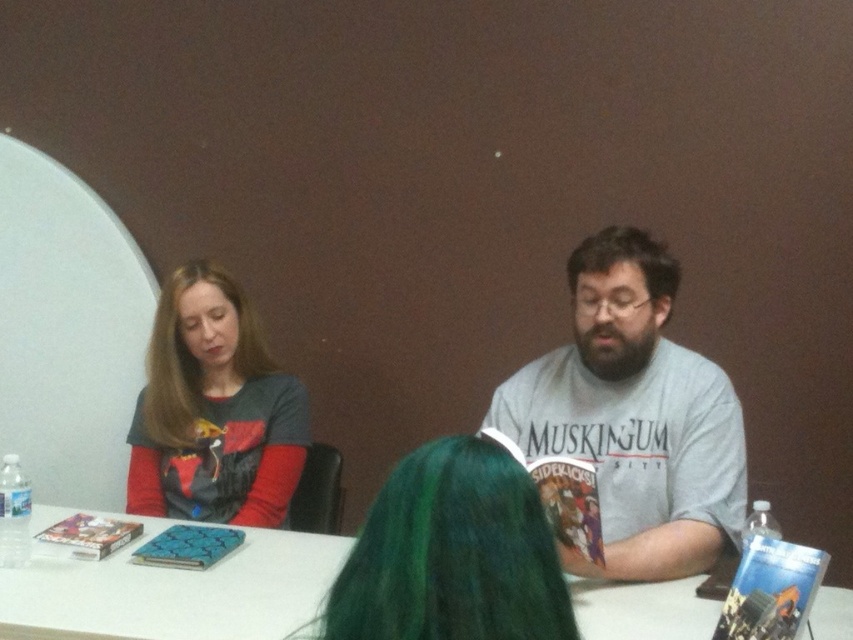
You are attending an event and notice two people at a table. The gray cotton shirt at center and the dark brown hair at center. Based on their positions, which one is sitting on the left side of the table?

The gray cotton shirt at center is to the left of dark brown hair at center, so the gray cotton shirt at center is sitting on the left side of the table.

You are standing at the back of the room and want to approach the two people at the table. The first person you see is at point (199,634), and the second is at point (647,268). Which person should you approach first if you want to reach the one in front first?

You should approach the person at point (199,634) first because it is in front of point (647,268) according to the spatial description.

You are an event organizer setting up chairs for an audience. You need to place a chair so that it faces the speaker. The speaker will be sitting at the white glossy table at center. Where should you place the chair relative to the matte gray sweater at left?

The white glossy table at center is positioned under the matte gray sweater at left, so you should place the chair in front of the white glossy table at center, which is located below the matte gray sweater at left.